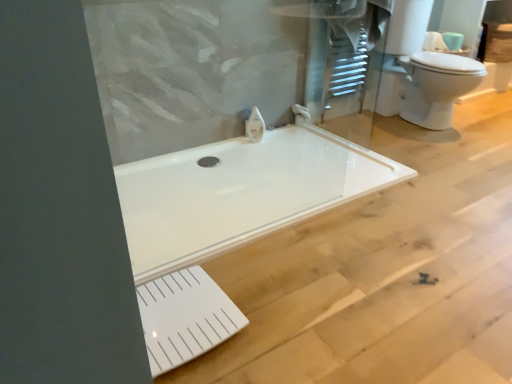
Question: Is white glossy faucet at upper center, which ranks as the 2th faucet in right-to-left order, positioned with its back to white glossy toilet at upper right?

Choices:
 (A) yes
 (B) no

Answer: (B)

Question: Can you confirm if white glossy faucet at upper center, which is the first faucet in front-to-back order, is positioned to the left of white glossy toilet at upper right?

Choices:
 (A) no
 (B) yes

Answer: (B)

Question: Is white glossy faucet at upper center, which is the first faucet in front-to-back order, outside of white glossy toilet at upper right?

Choices:
 (A) no
 (B) yes

Answer: (B)

Question: From a real-world perspective, is white glossy faucet at upper center, which is the first faucet in front-to-back order, positioned under white glossy toilet at upper right based on gravity?

Choices:
 (A) no
 (B) yes

Answer: (B)

Question: Does white glossy faucet at upper center, which is the first faucet in front-to-back order, have a larger size compared to white glossy toilet at upper right?

Choices:
 (A) yes
 (B) no

Answer: (B)

Question: Considering the positions of white glossy faucet at upper center, the first faucet in the left-to-right sequence, and white glossy faucet at upper center, which ranks as the 1th faucet in right-to-left order, in the image, is white glossy faucet at upper center, the first faucet in the left-to-right sequence, wider or thinner than white glossy faucet at upper center, which ranks as the 1th faucet in right-to-left order,?

Choices:
 (A) wide
 (B) thin

Answer: (B)

Question: Considering their positions, is white glossy faucet at upper center, positioned as the second faucet in back-to-front order, located in front of or behind white glossy faucet at upper center, the second faucet viewed from the left?

Choices:
 (A) behind
 (B) front

Answer: (B)

Question: Is white glossy faucet at upper center, positioned as the second faucet in back-to-front order, to the left or to the right of white glossy faucet at upper center, the 2th faucet viewed from the front, in the image?

Choices:
 (A) right
 (B) left

Answer: (B)

Question: In terms of height, does white glossy faucet at upper center, which is the first faucet in front-to-back order, look taller or shorter compared to white glossy faucet at upper center, arranged as the first faucet when viewed from the back?

Choices:
 (A) short
 (B) tall

Answer: (B)

Question: Considering their positions, is white glossy toilet at upper right located in front of or behind white glossy faucet at upper center, the second faucet viewed from the left?

Choices:
 (A) behind
 (B) front

Answer: (B)

Question: Is white glossy toilet at upper right wider or thinner than white glossy faucet at upper center, arranged as the first faucet when viewed from the back?

Choices:
 (A) wide
 (B) thin

Answer: (A)

Question: Do you think white glossy toilet at upper right is within white glossy faucet at upper center, the second faucet viewed from the left, or outside of it?

Choices:
 (A) outside
 (B) inside

Answer: (A)

Question: From the image's perspective, relative to white glossy faucet at upper center, which ranks as the 1th faucet in right-to-left order, is white glossy toilet at upper right above or below?

Choices:
 (A) below
 (B) above

Answer: (B)

Question: From the image's perspective, relative to white glossy toilet at upper right, is white matte toilet paper at upper right above or below?

Choices:
 (A) below
 (B) above

Answer: (B)

Question: From their relative heights in the image, would you say white matte toilet paper at upper right is taller or shorter than white glossy toilet at upper right?

Choices:
 (A) tall
 (B) short

Answer: (B)